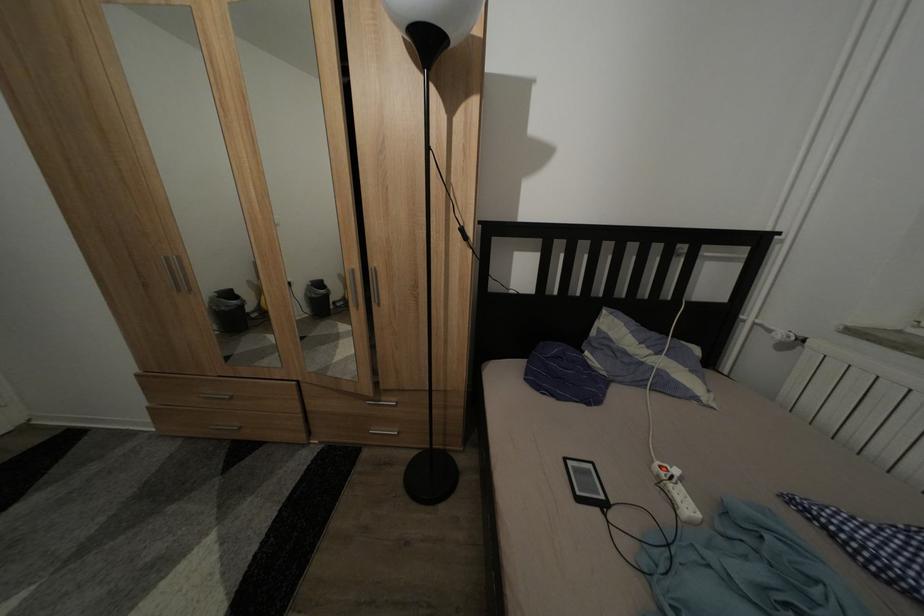
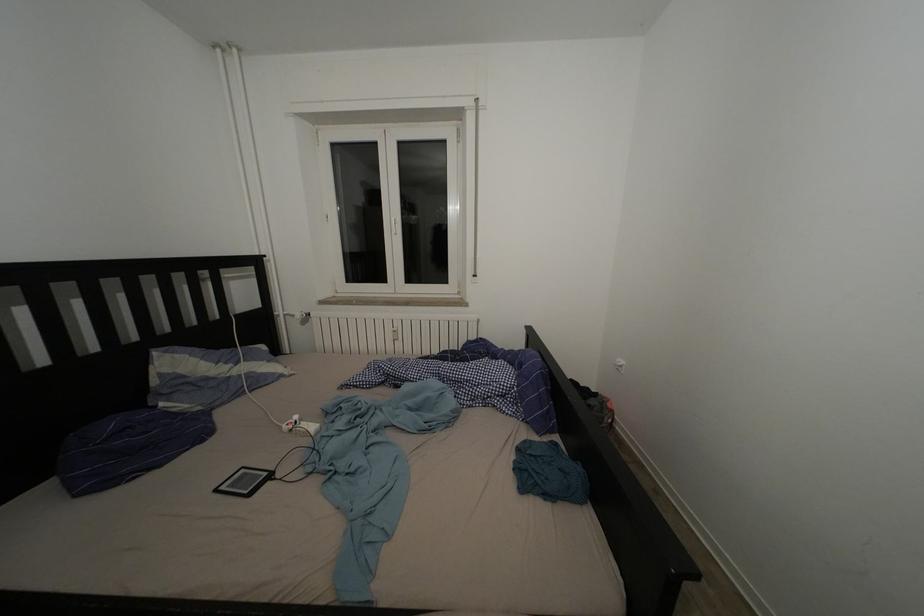
Question: The camera is either moving clockwise (left) or counter-clockwise (right) around the object. The first image is from the beginning of the video and the second image is from the end. Is the camera moving left or right when shooting the video?

Choices:
 (A) Left
 (B) Right

Answer: (A)